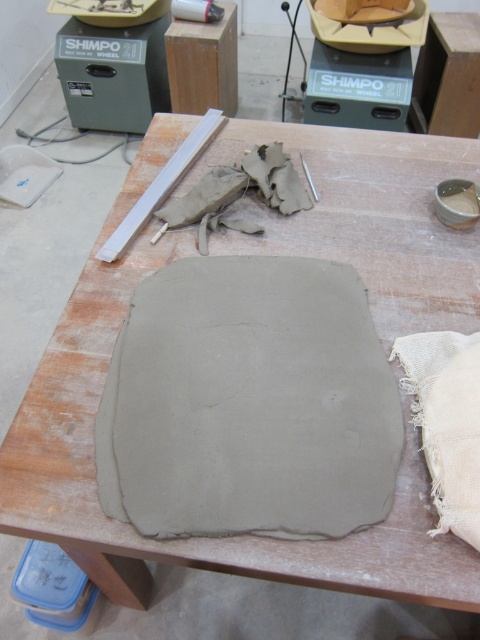
Question: Which object appears closest to the camera in this image?

Choices:
 (A) white burlap cloth at lower right
 (B) gray clay pad at center

Answer: (A)

Question: Among these points, which one is farthest from the camera?

Choices:
 (A) (337, 445)
 (B) (468, 392)

Answer: (A)

Question: Is gray clay pad at center thinner than white burlap cloth at lower right?

Choices:
 (A) yes
 (B) no

Answer: (B)

Question: Is gray clay pad at center bigger than white burlap cloth at lower right?

Choices:
 (A) no
 (B) yes

Answer: (B)

Question: Does gray clay pad at center lie in front of white burlap cloth at lower right?

Choices:
 (A) yes
 (B) no

Answer: (B)